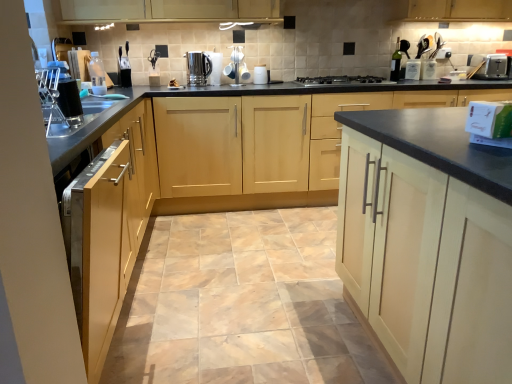
Locate an element on the screen. This screenshot has width=512, height=384. white glossy mugs at center, acting as the first appliance starting from the left is located at coordinates (237, 67).

What do you see at coordinates (237, 67) in the screenshot?
I see `white glossy mugs at center, the second appliance positioned from the back` at bounding box center [237, 67].

What do you see at coordinates (198, 68) in the screenshot? I see `satin silver kettle at center` at bounding box center [198, 68].

What do you see at coordinates (428, 242) in the screenshot? I see `light wood cabinet at right, the first cabinetry viewed from the right` at bounding box center [428, 242].

This screenshot has width=512, height=384. Find the location of `natural stone floor at center`. natural stone floor at center is located at coordinates (241, 304).

Does point (430, 306) appear closer or farther from the camera than point (499, 76)?

Point (430, 306) appears to be closer to the viewer than point (499, 76).

Which of these two, light wood cabinet at right, the first cabinetry viewed from the right, or satin silver toaster at upper right, is wider?

Wider between the two is light wood cabinet at right, the first cabinetry viewed from the right.

From the image's perspective, is light wood cabinet at right, which is the third cabinetry in left-to-right order, beneath satin silver toaster at upper right?

Yes, from the image's perspective, light wood cabinet at right, which is the third cabinetry in left-to-right order, is beneath satin silver toaster at upper right.

From a real-world perspective, between light wood cabinet at right, the first cabinetry viewed from the right, and satin silver toaster at upper right, who is vertically lower?

light wood cabinet at right, the first cabinetry viewed from the right, is physically lower.

Which object is further away from the camera taking this photo, transparent plastic bottle at upper left, which is the second bottle from right to left, or satin silver kettle at center?

satin silver kettle at center is behind.

Which of these two, transparent plastic bottle at upper left, which is the 1th bottle from front to back, or satin silver kettle at center, is smaller?

With smaller size is transparent plastic bottle at upper left, which is the 1th bottle from front to back.

Is point (96, 66) farther from camera compared to point (205, 66)?

That is False.

Between transparent plastic bottle at upper left, the 2th bottle when ordered from back to front, and satin silver kettle at center, which one has less height?

satin silver kettle at center.

Which of these two, light wood cabinet at right, the first cabinetry viewed from the right, or natural stone floor at center, is wider?

Wider between the two is natural stone floor at center.

Is light wood cabinet at right, the first cabinetry viewed from the right, in contact with natural stone floor at center?

No, light wood cabinet at right, the first cabinetry viewed from the right, is not making contact with natural stone floor at center.

What's the angular difference between light wood cabinet at right, the first cabinetry viewed from the right, and natural stone floor at center's facing directions?

90.6 degrees separate the facing orientations of light wood cabinet at right, the first cabinetry viewed from the right, and natural stone floor at center.

Is light wood cabinet at right, which is the third cabinetry in left-to-right order, at the left side of natural stone floor at center?

No.

Is natural stone floor at center positioned beyond the bounds of satin silver kettle at center?

Yes, natural stone floor at center is located beyond the bounds of satin silver kettle at center.

Does natural stone floor at center lie behind satin silver kettle at center?

No, natural stone floor at center is closer to the camera.

How different are the orientations of natural stone floor at center and satin silver kettle at center in degrees?

They differ by 176 degrees in their facing directions.

Is point (152, 328) farther from camera compared to point (194, 65)?

No, (152, 328) is in front of (194, 65).

In the scene shown: What's the angular difference between light wood cabinet at center, placed as the second cabinetry when sorted from left to right, and satin silver kettle at center's facing directions?

4.04 degrees separate the facing orientations of light wood cabinet at center, placed as the second cabinetry when sorted from left to right, and satin silver kettle at center.

Does point (321, 105) lie behind point (201, 73)?

No.

Which of these two, light wood cabinet at center, placed as the second cabinetry when sorted from left to right, or satin silver kettle at center, stands taller?

light wood cabinet at center, placed as the second cabinetry when sorted from left to right.

In the scene shown: Does satin silver kettle at center have a larger size compared to transparent plastic bottle at upper left, the 2th bottle from the top?

Yes.

How different are the orientations of satin silver kettle at center and transparent plastic bottle at upper left, the 1th bottle when ordered from bottom to top, in degrees?

The angular difference between satin silver kettle at center and transparent plastic bottle at upper left, the 1th bottle when ordered from bottom to top, is 179 degrees.

Could you tell me if satin silver kettle at center is facing transparent plastic bottle at upper left, the 1th bottle from the left?

No.

Between satin silver kettle at center and transparent plastic bottle at upper left, which is the second bottle from right to left, which one has larger width?

satin silver kettle at center is wider.

Is satin silver kettle at center aimed at natural stone floor at center?

No.

What's the angular difference between satin silver kettle at center and natural stone floor at center's facing directions?

satin silver kettle at center and natural stone floor at center are facing 176 degrees away from each other.

Where is `home appliance that is behind the natural stone floor at center`? home appliance that is behind the natural stone floor at center is located at coordinates (198, 68).

Considering the sizes of objects satin silver kettle at center and natural stone floor at center in the image provided, who is smaller, satin silver kettle at center or natural stone floor at center?

satin silver kettle at center is smaller.

Find the location of a particular element. This screenshot has width=512, height=384. kitchen appliance behind the light wood cabinet at right, the first cabinetry viewed from the right is located at coordinates (488, 66).

Where is `bottle located below the satin silver kettle at center (from the image's perspective)`? This screenshot has height=384, width=512. bottle located below the satin silver kettle at center (from the image's perspective) is located at coordinates (96, 70).

Based on their spatial positions, is satin silver toaster at upper right or matte wood cabinet at left, which is the 1th cabinetry in left-to-right order, closer to satin silver kettle at center?

matte wood cabinet at left, which is the 1th cabinetry in left-to-right order, is closer to satin silver kettle at center.

Looking at the image, which one is located further to satin silver toaster at upper right, light wood cabinet at center, placed as the second cabinetry when sorted from left to right, or natural stone floor at center?

The object further to satin silver toaster at upper right is natural stone floor at center.

Looking at this image, looking at the image, which one is located closer to green glass bottle at upper right, placed as the first bottle when sorted from back to front, light wood cabinet at center, placed as the second cabinetry when sorted from left to right, or natural stone floor at center?

light wood cabinet at center, placed as the second cabinetry when sorted from left to right, is positioned closer to the anchor green glass bottle at upper right, placed as the first bottle when sorted from back to front.

Estimate the real-world distances between objects in this image. Which object is closer to light wood cabinet at center, which is the 2th cabinetry from right to left, white glossy mugs at center, the second appliance viewed from the right, or green glass bottle at upper right, which is the 1th bottle from top to bottom?

Based on the image, white glossy mugs at center, the second appliance viewed from the right, appears to be nearer to light wood cabinet at center, which is the 2th cabinetry from right to left.

From the image, which object appears to be farther from natural stone floor at center, satin silver kettle at center or black matte gas stove at center?

The object further to natural stone floor at center is satin silver kettle at center.

From the image, which object appears to be farther from matte wood cabinet at left, which is counted as the third cabinetry, starting from the right, satin silver kettle at center or green glass bottle at upper right, which is the second bottle in left-to-right order?

Among the two, green glass bottle at upper right, which is the second bottle in left-to-right order, is located further to matte wood cabinet at left, which is counted as the third cabinetry, starting from the right.

Looking at the image, which one is located further to black matte gas stove at center, natural stone floor at center or light wood cabinet at center, placed as the second cabinetry when sorted from left to right?

natural stone floor at center is positioned further to the anchor black matte gas stove at center.

Based on their spatial positions, is satin silver toaster at upper right or green glass bottle at upper right, which is the 1th bottle from top to bottom, further from black matte gas stove at center?

satin silver toaster at upper right lies further to black matte gas stove at center than the other object.

You are a GUI agent. You are given a task and a screenshot of the screen. Output one action in this format:
    pyautogui.click(x=<x>, y=<y>)
    Task: Click on the cabinetry between light wood cabinet at right, which is the third cabinetry in left-to-right order, and light wood cabinet at center, placed as the second cabinetry when sorted from left to right, in the front-back direction
    
    Given the screenshot: What is the action you would take?
    pyautogui.click(x=109, y=227)

At what (x,y) coordinates should I click in order to perform the action: click on cabinetry positioned between matte wood cabinet at left, which is the 1th cabinetry in left-to-right order, and black matte gas stove at center from near to far. Please return your answer as a coordinate pair (x, y). Looking at the image, I should click on (303, 150).

Find the location of a particular element. The height and width of the screenshot is (384, 512). cabinetry between matte wood cabinet at left, which is the 1th cabinetry in left-to-right order, and white glossy mugs at center, the second appliance positioned from the back, from front to back is located at coordinates (303, 150).

Find the location of `bottle positioned between natural stone floor at center and black matte gas stove at center from near to far`. bottle positioned between natural stone floor at center and black matte gas stove at center from near to far is located at coordinates (96, 70).